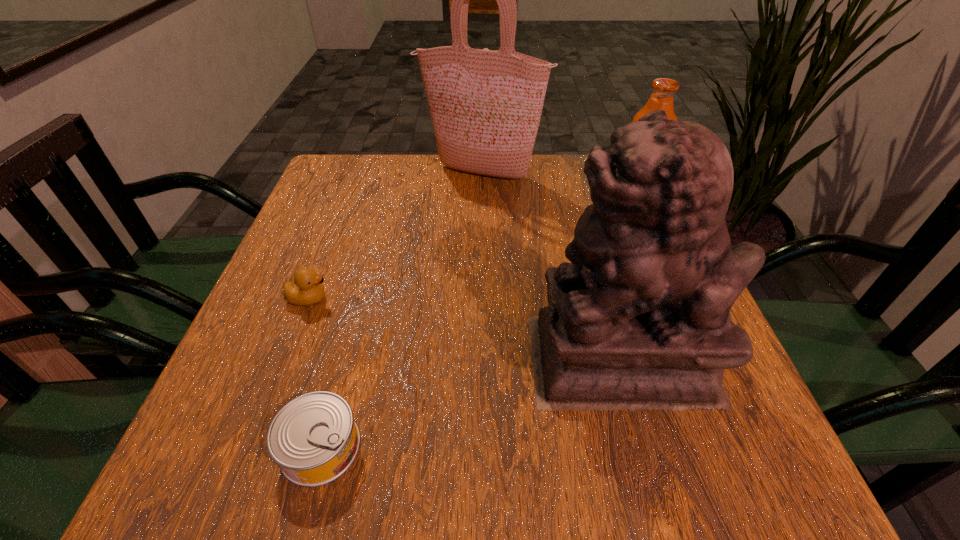
Identify the location of the farthest object. The height and width of the screenshot is (540, 960). (485, 105).

Where is `sculpture`? The image size is (960, 540). sculpture is located at coordinates (640, 319).

At what (x,y) coordinates should I click in order to perform the action: click on the third tallest object. Please return your answer as a coordinate pair (x, y). This screenshot has height=540, width=960. Looking at the image, I should click on (663, 89).

This screenshot has width=960, height=540. I want to click on the second farthest object, so click(663, 89).

In order to click on the leftmost object in this screenshot , I will do `click(307, 289)`.

Where is `the third farthest object`? This screenshot has height=540, width=960. the third farthest object is located at coordinates (307, 289).

What are the coordinates of `can` in the screenshot? It's located at (314, 439).

You are a GUI agent. You are given a task and a screenshot of the screen. Output one action in this format:
    pyautogui.click(x=<x>, y=<y>)
    Task: Click on the shortest object
    
    Given the screenshot: What is the action you would take?
    pyautogui.click(x=314, y=439)

Where is `vacant space situated 0.080m on the front of the shopping bag`? The image size is (960, 540). vacant space situated 0.080m on the front of the shopping bag is located at coordinates (481, 205).

Where is `vacant position located 0.250m on the front-facing side of the sculpture`? This screenshot has width=960, height=540. vacant position located 0.250m on the front-facing side of the sculpture is located at coordinates (382, 360).